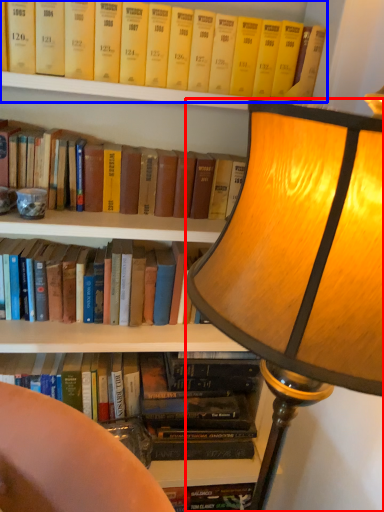
Question: Which point is closer to the camera, lamp (highlighted by a red box) or book (highlighted by a blue box)?

Choices:
 (A) lamp
 (B) book

Answer: (A)